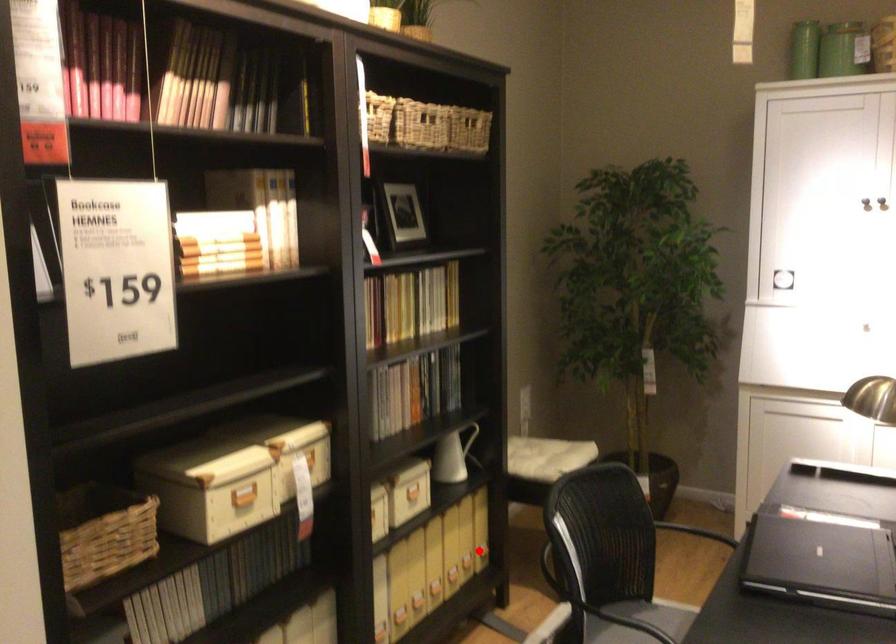
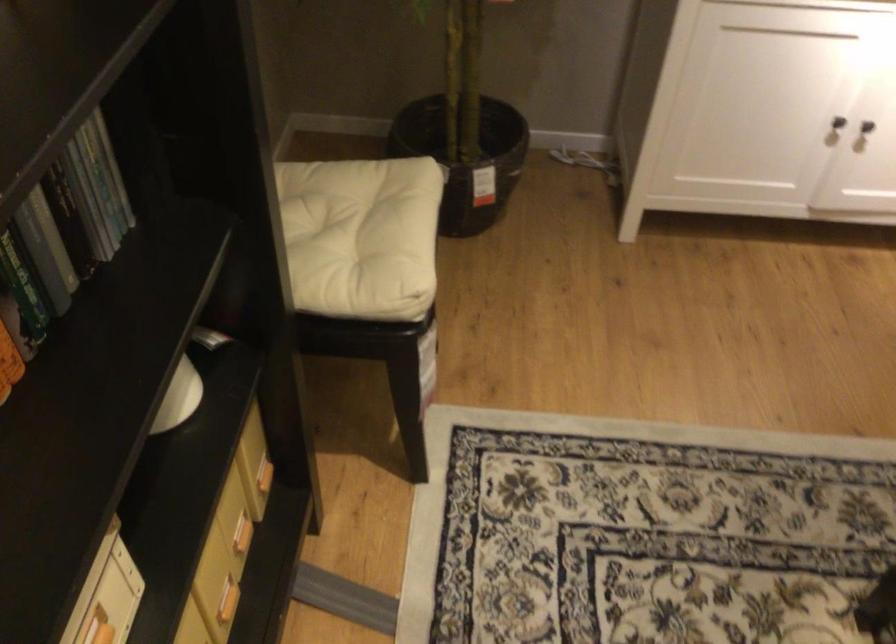
Question: I am providing you with two images of the same scene from different viewpoints. A red point is shown in image1. For the corresponding object point in image2, is it positioned nearer or farther from the camera?

Choices:
 (A) Nearer
 (B) Farther

Answer: (A)